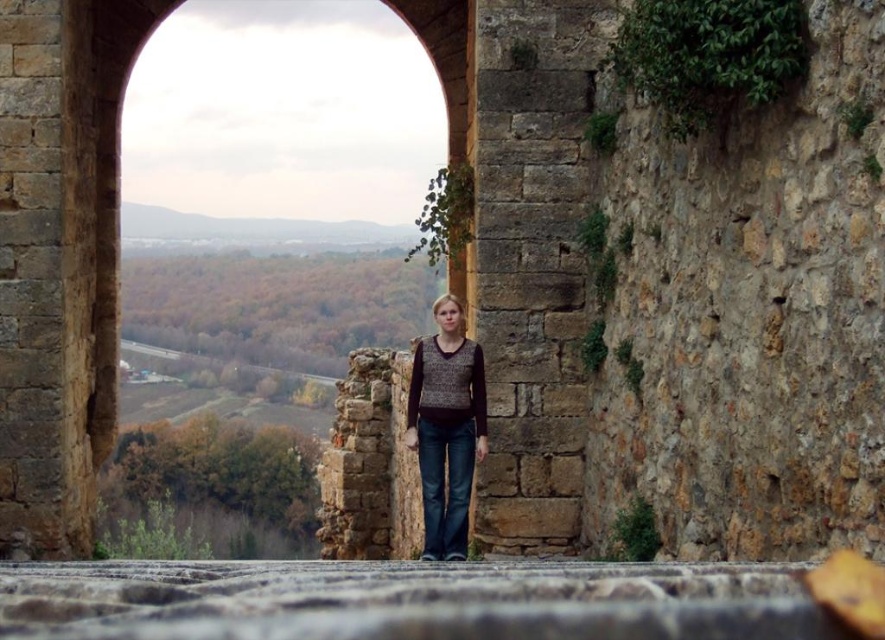
Is stone archway at center smaller than knit sweater at center?

Incorrect, stone archway at center is not smaller in size than knit sweater at center.

The image size is (885, 640). What do you see at coordinates (101, 193) in the screenshot? I see `stone archway at center` at bounding box center [101, 193].

Who is more distant from viewer, (114, 316) or (419, 380)?

The point (114, 316) is more distant.

Locate an element on the screen. stone archway at center is located at coordinates (101, 193).